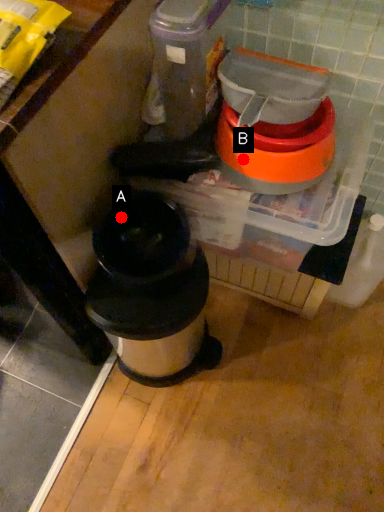
Question: Two points are circled on the image, labeled by A and B beside each circle. Which of the following is the farthest from the observer?

Choices:
 (A) A is further
 (B) B is further

Answer: (A)